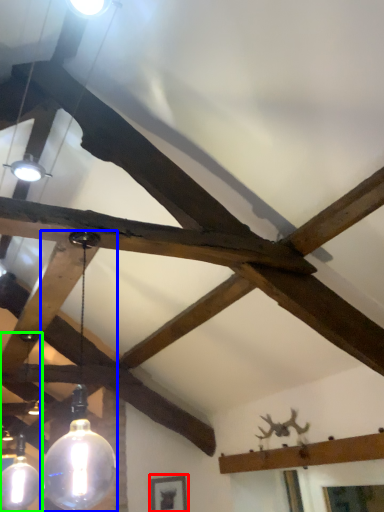
Question: Considering the real-world distances, which object is farthest from picture frame (highlighted by a red box)? lamp (highlighted by a blue box) or lamp (highlighted by a green box)?

Choices:
 (A) lamp
 (B) lamp

Answer: (A)